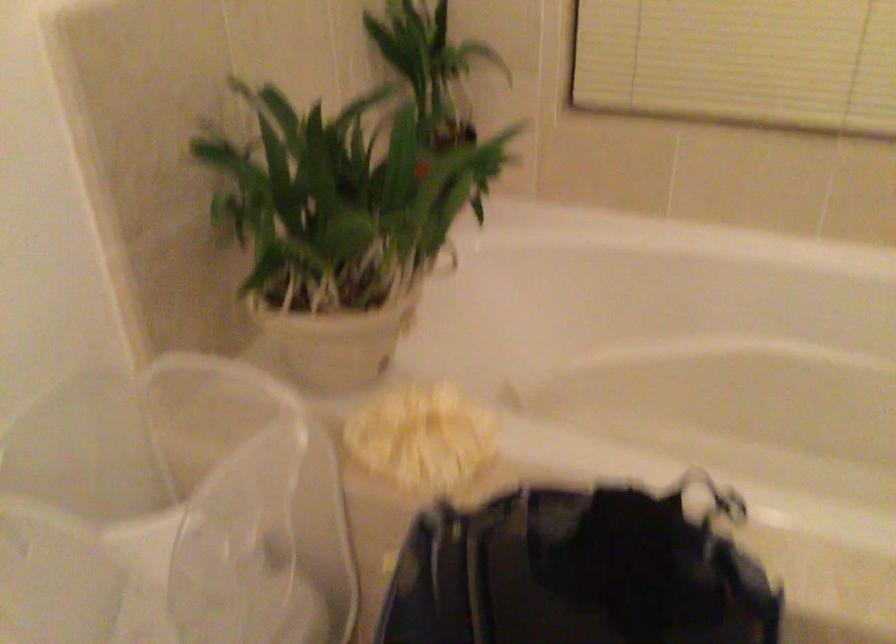
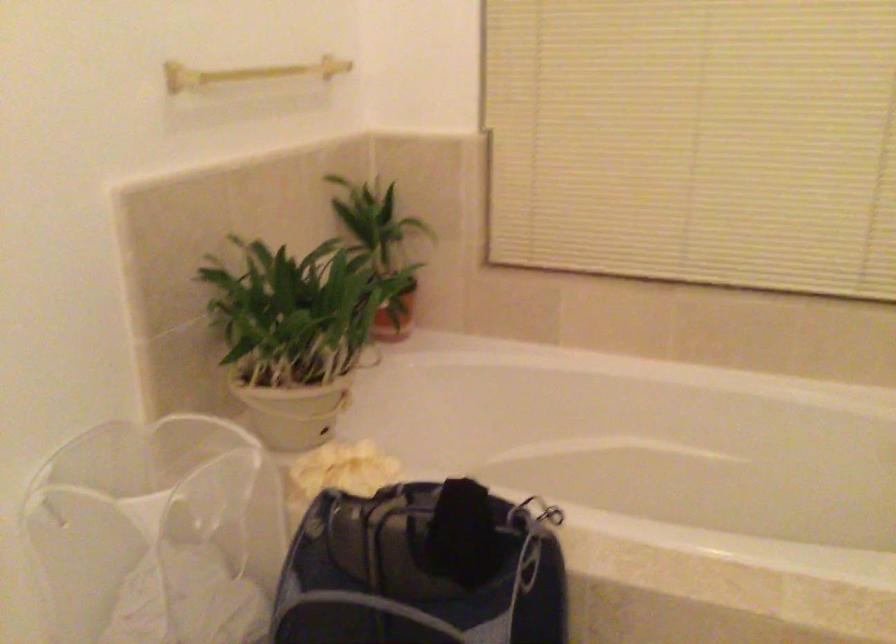
Question: How did the camera likely rotate?

Choices:
 (A) Left
 (B) Right
 (C) Up
 (D) Down

Answer: (C)